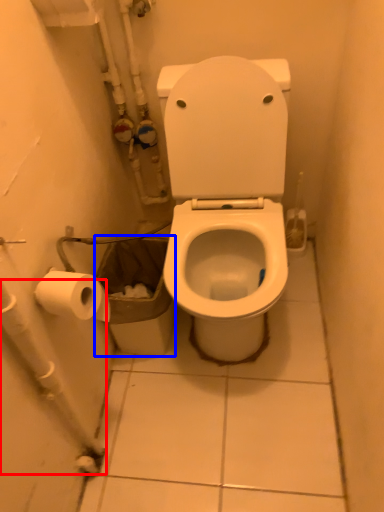
Question: Which of the following is the closest to the observer, water pipe (highlighted by a red box) or garbage (highlighted by a blue box)?

Choices:
 (A) water pipe
 (B) garbage

Answer: (A)